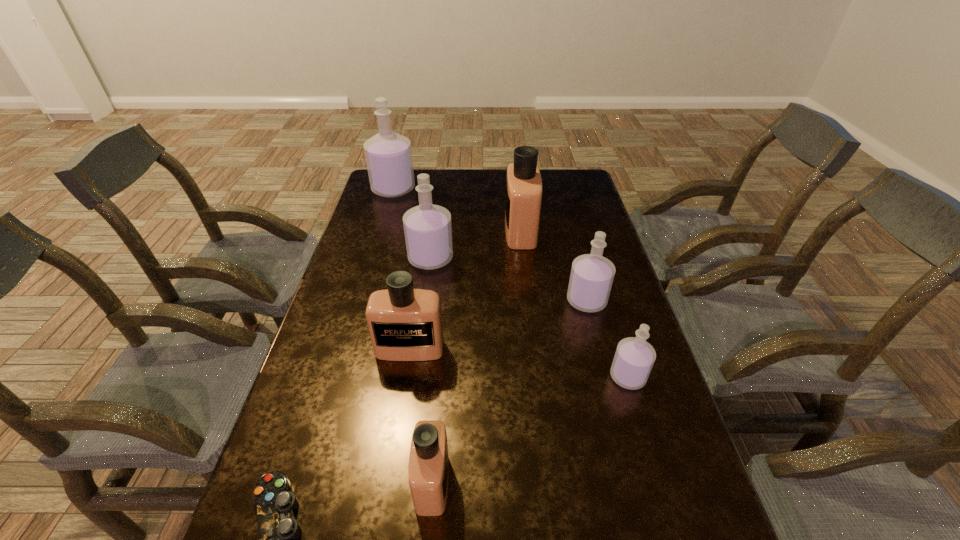
The width and height of the screenshot is (960, 540). I want to click on free region located 0.180m on the front label of the fourth nearest object, so click(397, 427).

Where is `vacant space located 0.200m on the front label of the smallest beige perfume`? The height and width of the screenshot is (540, 960). vacant space located 0.200m on the front label of the smallest beige perfume is located at coordinates (548, 482).

Find the location of a particular element. The image size is (960, 540). blank space located 0.240m on the front of the nearest purple perfume is located at coordinates (664, 496).

I want to click on object that is at the far edge, so click(388, 155).

Find the location of a particular element. The height and width of the screenshot is (540, 960). object that is at the left edge is located at coordinates (x=388, y=155).

Image resolution: width=960 pixels, height=540 pixels. I want to click on object at the far left corner, so 388,155.

In the image, there is a desktop. At what (x,y) coordinates should I click in order to perform the action: click on vacant space at the left edge. Please return your answer as a coordinate pair (x, y). The width and height of the screenshot is (960, 540). Looking at the image, I should click on (367, 228).

Identify the location of vacant region at the right edge of the desktop. This screenshot has height=540, width=960. coord(619,464).

This screenshot has width=960, height=540. In the image, there is a desktop. Identify the location of vacant space at the far left corner. (370, 192).

Identify the location of free space between the third nearest object and the nearest perfume. (530, 429).